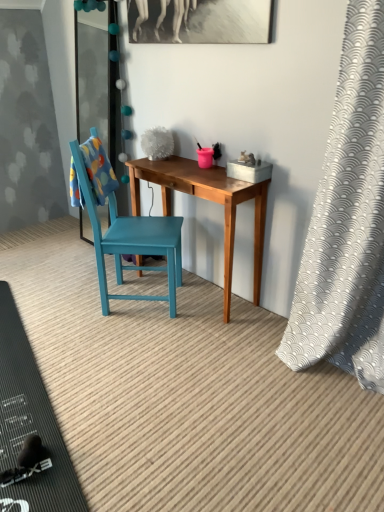
Where is `free point below white textured curtain at right (from a real-world perspective)`? This screenshot has width=384, height=512. free point below white textured curtain at right (from a real-world perspective) is located at coordinates (342, 381).